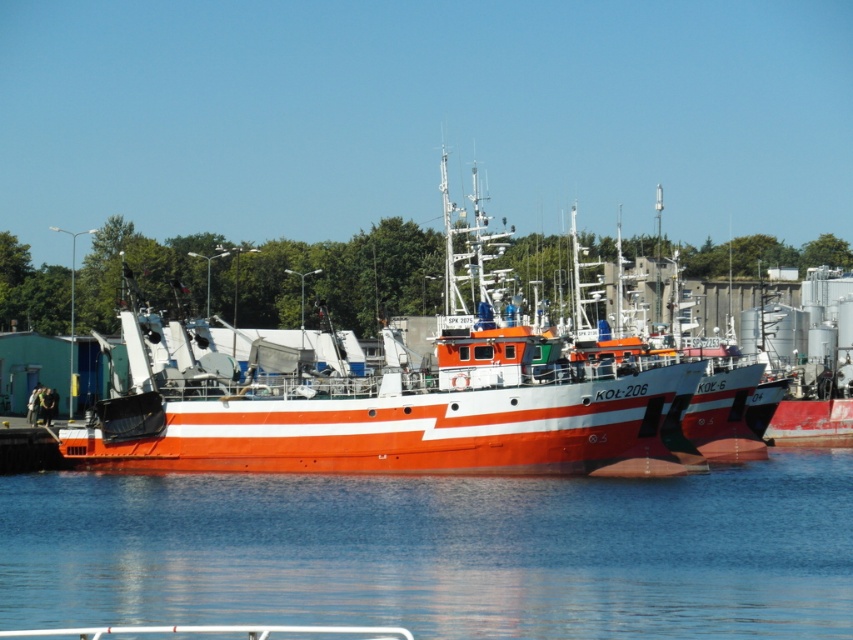
You are a marine biologist observing the marina from a boat. You notice two points marked on your map at coordinates point [241,536] and point [224,358]. Which point is closer to your current position?

Point [241,536] is in front of point [224,358], so it is closer to your current position.

You are a photographer planning to capture a wide shot of the marina. You notice the transparent water at center and the orange glossy boat at center in your frame. Based on their sizes in the image, which object would appear wider in the photo?

The transparent water at center appears wider in the photo because its width is larger than that of the orange glossy boat at center.